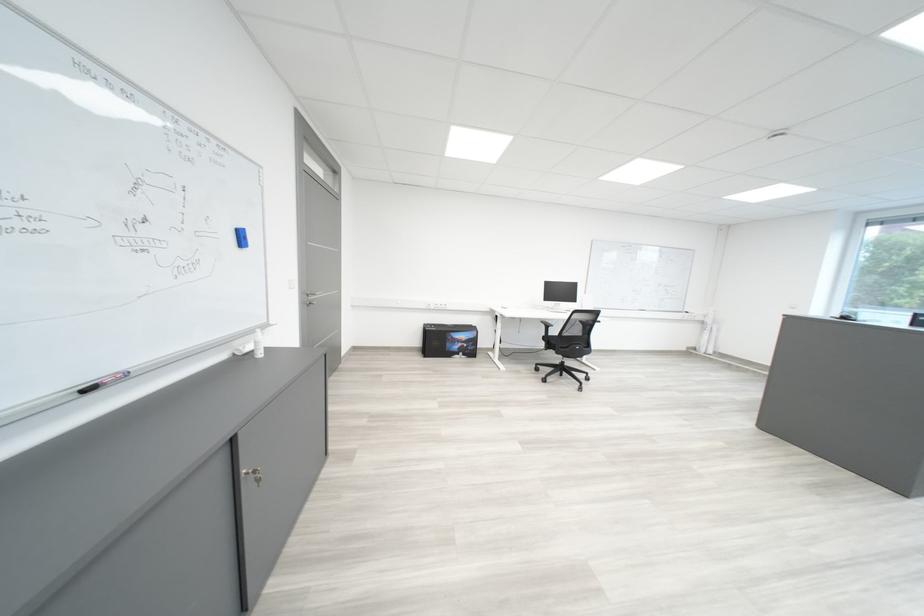
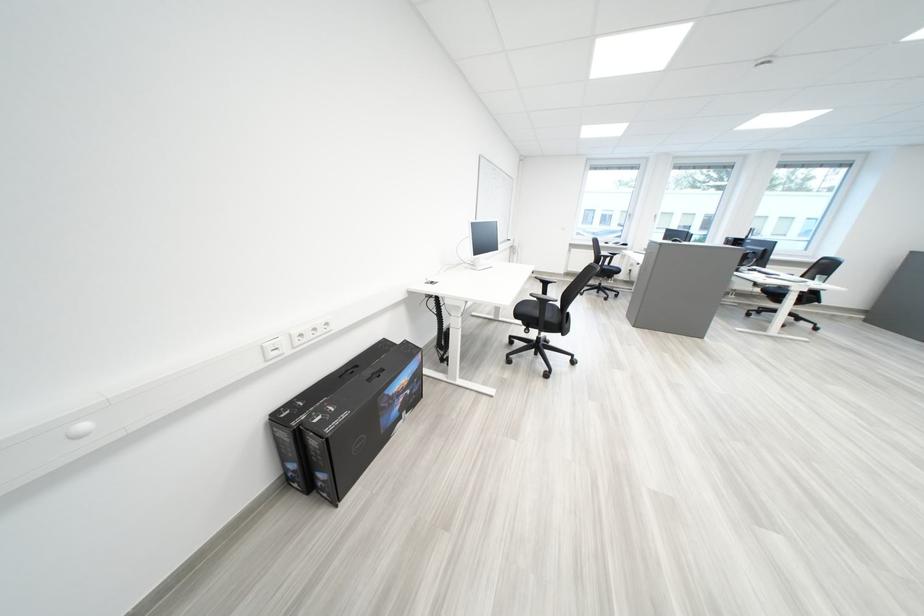
In the second image, find the point that corresponds to [471,342] in the first image.

(411, 395)